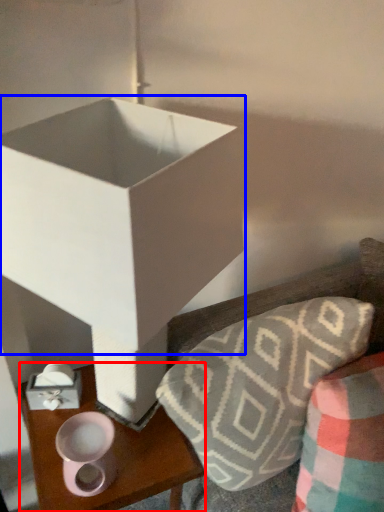
Question: Which point is closer to the camera, table (highlighted by a red box) or box (highlighted by a blue box)?

Choices:
 (A) table
 (B) box

Answer: (B)